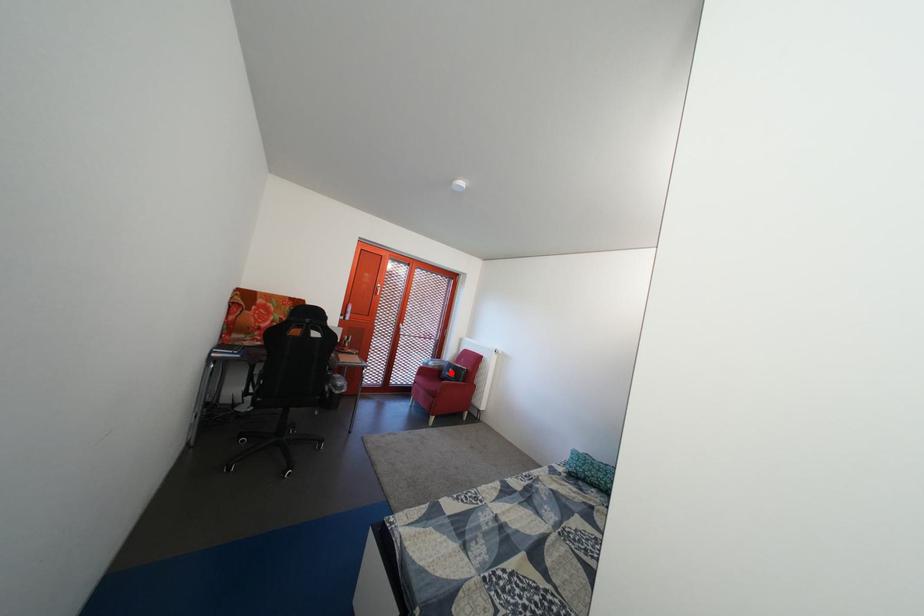
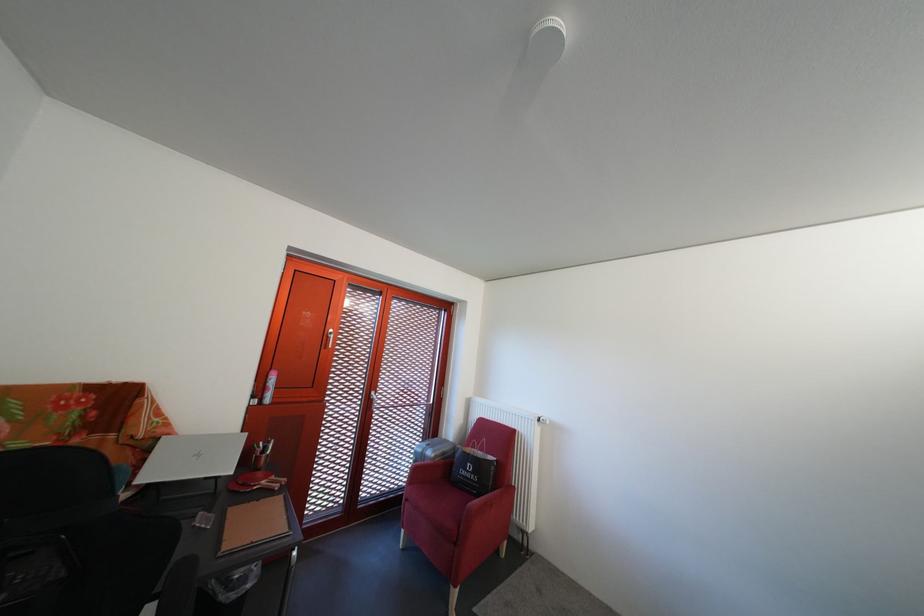
Locate, in the second image, the point that corresponds to the highlighted location in the first image.

(455, 460)